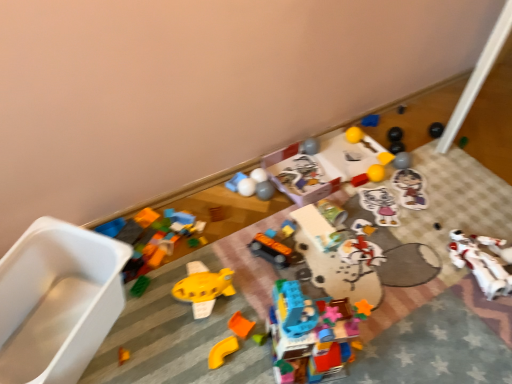
At what (x,y) coordinates should I click in order to perform the action: click on free space between matte plastic sticker at center, which is the second toy in right-to-left order, and orange matte block at center, which ranks as the fifth toy in left-to-right order. Please return your answer as a coordinate pair (x, y). Looking at the image, I should click on (355, 236).